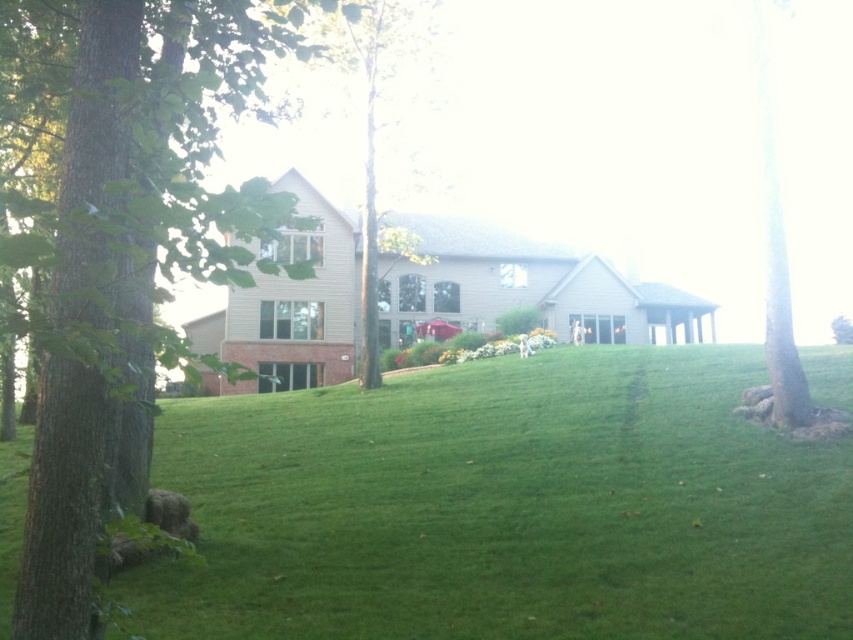
You are standing in the garden in front of the house and notice two green leafy trees. Which tree, the green leafy tree at center or the green leafy tree at right, is taller?

The green leafy tree at center is taller than the green leafy tree at right.

You are planning to plant a new flower bed between the brown rough bark tree at right and the green leafy tree at right. Which tree has a narrower trunk to allow more space for the flowers?

The brown rough bark tree at right has a narrower trunk than the green leafy tree at right, so it will allow more space for the flower bed.

You are standing in the garden of the house and see a red umbrella. There is also a point marked at coordinates (131,253). What object is located at that point?

The point at (131,253) indicates a brown rough tree at left.